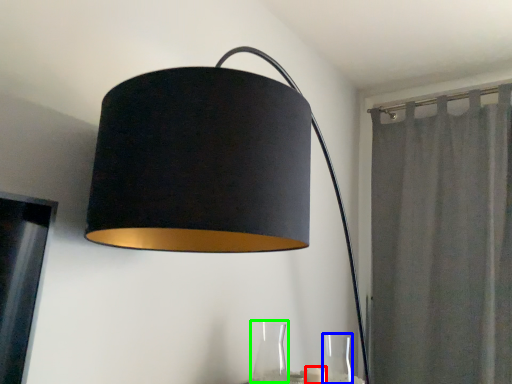
Question: Which object is positioned closest to candle (highlighted by a red box)? Select from glass vase (highlighted by a blue box) and glass vase (highlighted by a green box).

Choices:
 (A) glass vase
 (B) glass vase

Answer: (A)